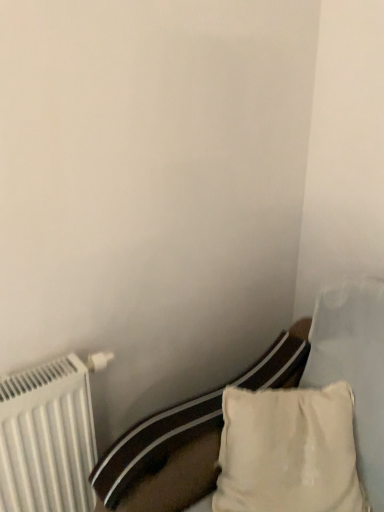
Question: Should I look upward or downward to see white cotton pillow at lower right?

Choices:
 (A) up
 (B) down

Answer: (B)